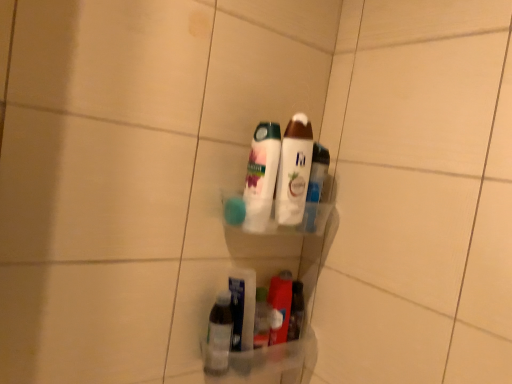
Question: From a real-world perspective, is white glossy lotion at center, the third bottle positioned from the bottom, physically located above or below clear plastic bottle at lower center, which is counted as the 1th bottle, starting from the bottom?

Choices:
 (A) above
 (B) below

Answer: (A)

Question: Is white glossy lotion at center, which appears as the 1th bottle when viewed from the top, to the left or to the right of clear plastic bottle at lower center, the 3th bottle positioned from the top, in the image?

Choices:
 (A) right
 (B) left

Answer: (A)

Question: Based on their relative distances, which object is nearer to the white glossy lotion at center, the third bottle positioned from the bottom?

Choices:
 (A) translucent plastic bottles at center, positioned as the second bottle in top-to-bottom order
 (B) clear plastic bottle at lower center, which is counted as the 1th bottle, starting from the bottom

Answer: (A)

Question: Estimate the real-world distances between objects in this image. Which object is farther from the clear plastic bottle at lower center, the 3th bottle positioned from the top?

Choices:
 (A) white glossy lotion at center, which appears as the 1th bottle when viewed from the top
 (B) translucent plastic bottles at center, positioned as the 2th bottle in bottom-to-top order

Answer: (A)